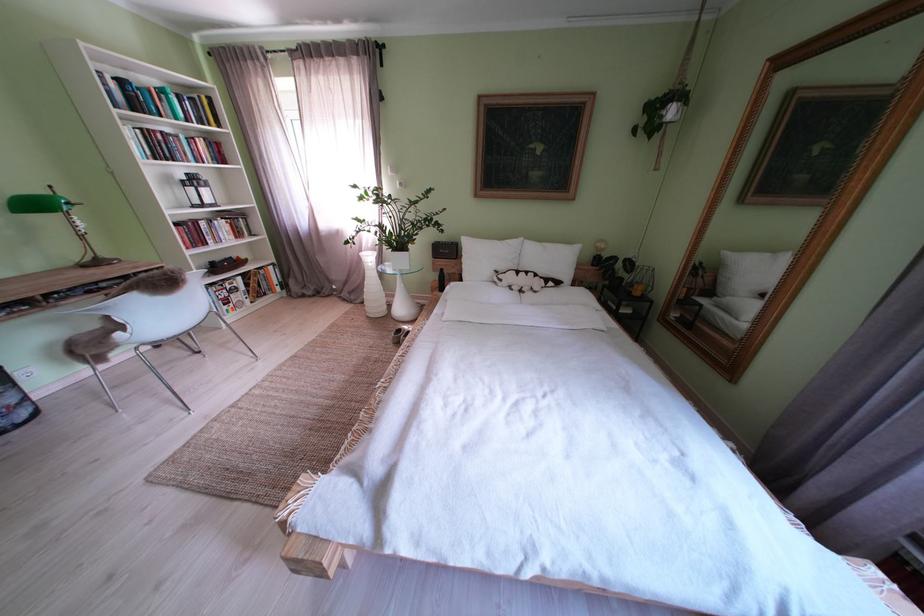
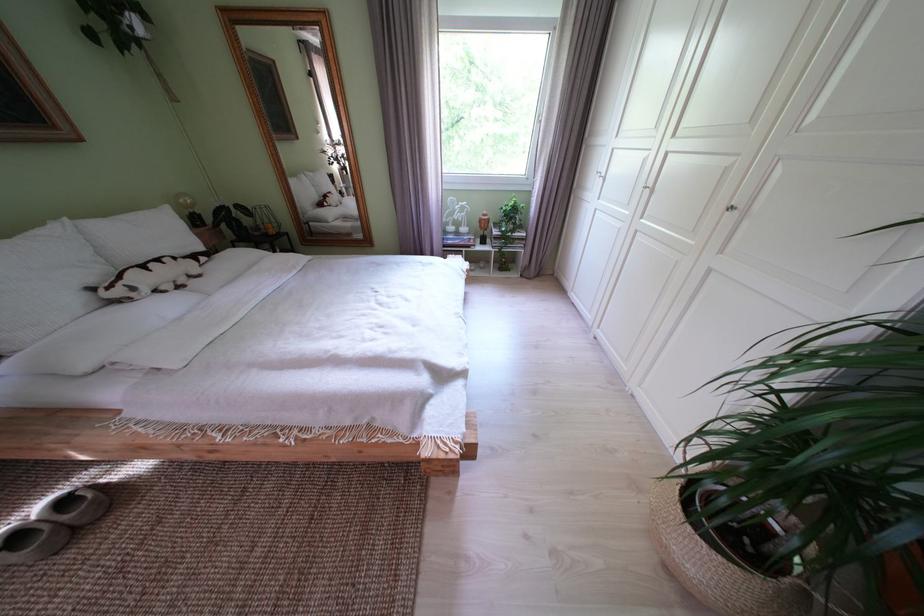
The point at (512, 285) is marked in the first image. Where is the corresponding point in the second image?

(146, 294)